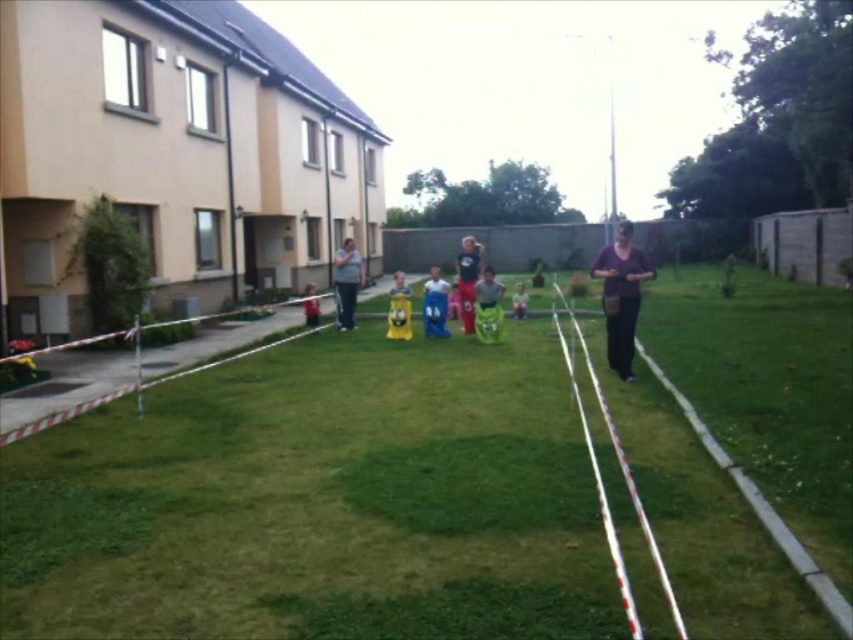
Between red fabric child at center and yellow fabric child at center, which one has less height?

yellow fabric child at center

This screenshot has height=640, width=853. What do you see at coordinates (310, 307) in the screenshot?
I see `red fabric child at center` at bounding box center [310, 307].

Is point (312, 324) behind point (517, 296)?

No, it is not.

Identify the location of red fabric child at center. (310, 307).

Based on the photo, between white plastic tape at center and matte blue shorts at center, which one appears on the left side from the viewer's perspective?

matte blue shorts at center

Does point (630, 474) come in front of point (473, 330)?

Yes, it is.

What do you see at coordinates (627, 476) in the screenshot? The width and height of the screenshot is (853, 640). I see `white plastic tape at center` at bounding box center [627, 476].

Identify the location of white plastic tape at center. (627, 476).

Does white plastic tape at center have a larger size compared to red fabric child at center?

Yes.

Can you confirm if white plastic tape at center is wider than red fabric child at center?

Correct, the width of white plastic tape at center exceeds that of red fabric child at center.

Measure the distance between white plastic tape at center and camera.

A distance of 2.49 meters exists between white plastic tape at center and camera.

Locate an element on the screen. white plastic tape at center is located at coordinates (627, 476).